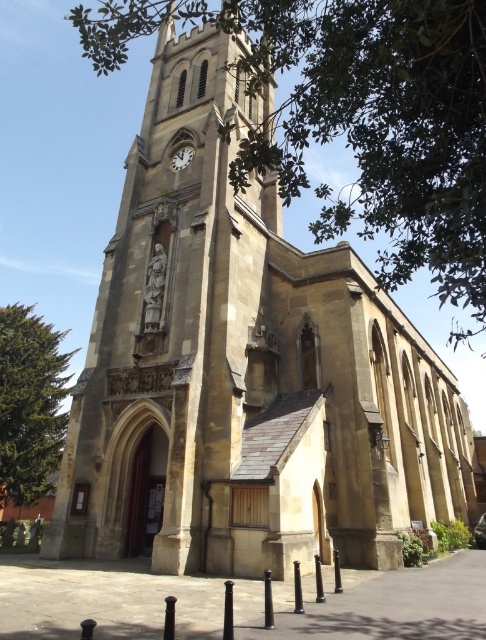
You are standing in front of the historic stone church and want to take a photo of the point at coordinates point (x=48, y=433). Your camera has a maximum focus range of 70 meters. Will the camera be able to focus on the point?

The distance of point (x=48, y=433) from the camera is 76.51 meters, which exceeds the camera maximum focus range of 70 meters. Therefore, the camera will not be able to focus on the point.

You are a visitor standing in front of the historic stone church. You notice the green leafy tree at left and the white glossy clock at upper center. Which object appears bigger in the image?

The green leafy tree at left appears bigger than the white glossy clock at upper center because it is larger in size.

You are standing in front of the historic stone church and want to take a photo of the green leafy tree at left. Where should you position yourself to capture it in the frame?

The green leafy tree at left is located at point (30, 403), so you should position yourself to the left side of the church to capture it in the frame.